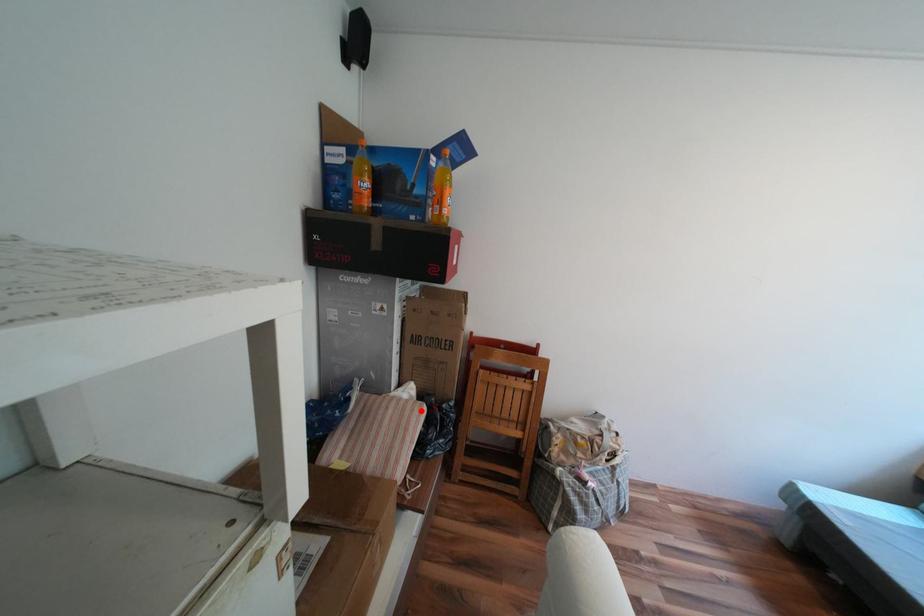
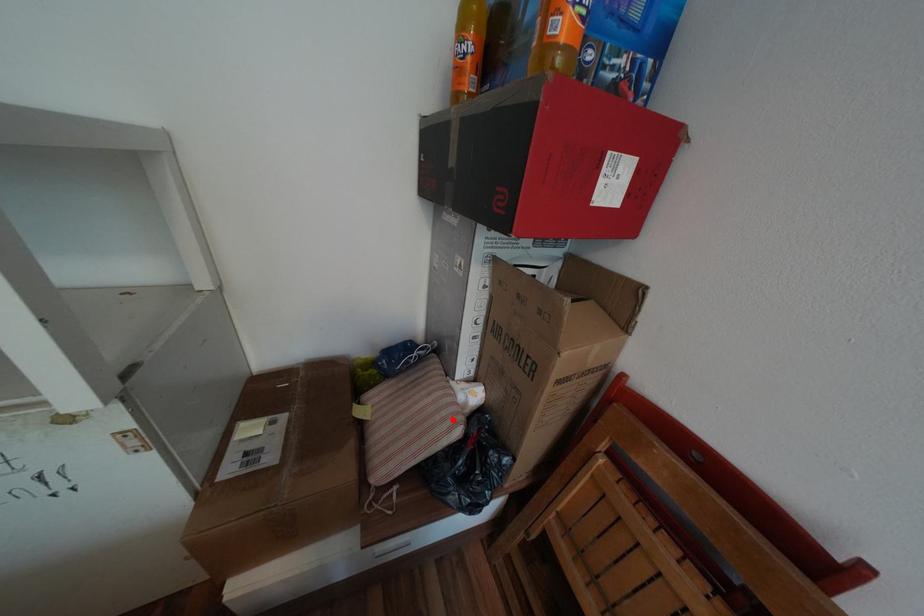
I am providing you with two images of the same scene from different viewpoints. A red point is marked on the first image and another point is marked on the second image. Are the points marked in image1 and image2 representing the same 3D position?

Yes